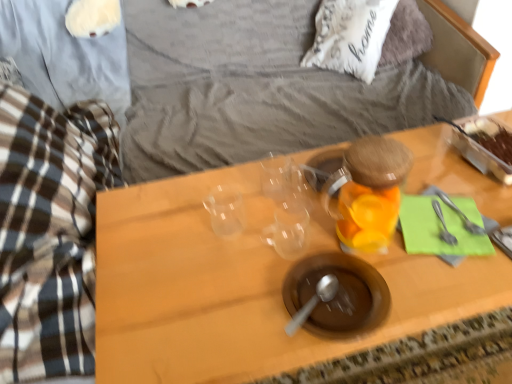
Locate an element on the screen. The height and width of the screenshot is (384, 512). free point to the left of transparent glass jar at center-right is located at coordinates (283, 235).